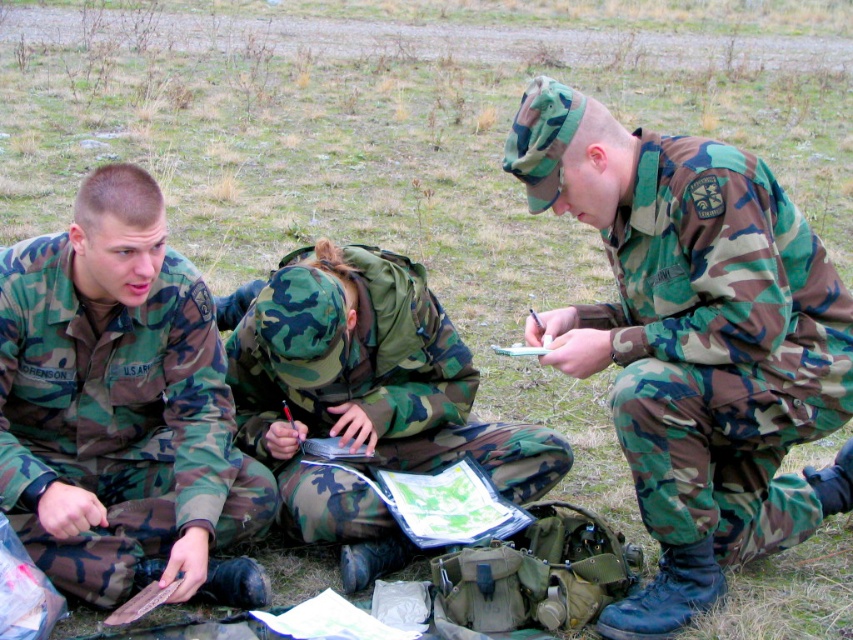
Question: Is camouflage fabric uniform at center positioned in front of camo fabric uniform at center?

Choices:
 (A) yes
 (B) no

Answer: (A)

Question: Which of the following is the closest to the observer?

Choices:
 (A) camouflage uniform at left
 (B) camouflage fabric uniform at center
 (C) camo fabric uniform at center

Answer: (B)

Question: Does camouflage fabric uniform at center appear on the left side of camo fabric uniform at center?

Choices:
 (A) yes
 (B) no

Answer: (B)

Question: Estimate the real-world distances between objects in this image. Which object is closer to the camo fabric uniform at center?

Choices:
 (A) camouflage uniform at left
 (B) camouflage fabric uniform at center

Answer: (A)

Question: Is camouflage fabric uniform at center to the right of camouflage uniform at left from the viewer's perspective?

Choices:
 (A) no
 (B) yes

Answer: (B)

Question: Which point is farther from the camera taking this photo?

Choices:
 (A) (592, 352)
 (B) (187, 566)

Answer: (A)